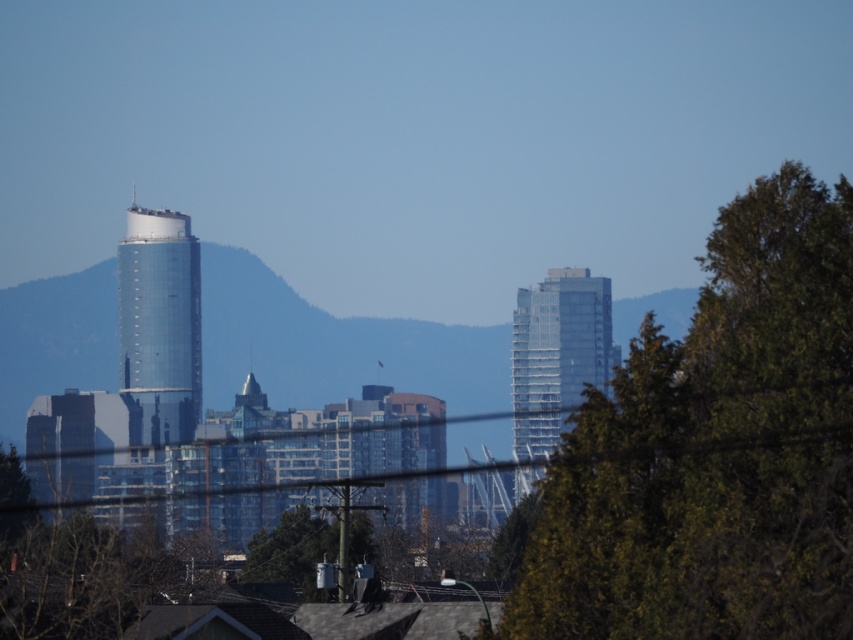
Question: Which object appears closest to the camera in this image?

Choices:
 (A) green matte tree at center
 (B) glossy glass tower at left

Answer: (A)

Question: Which of the following is the closest to the observer?

Choices:
 (A) green leafy tree at lower left
 (B) green matte tree at center

Answer: (B)

Question: Can you confirm if green leafy tree at right is positioned to the right of green leafy tree at lower left?

Choices:
 (A) no
 (B) yes

Answer: (B)

Question: Is glossy glass tower at left below green matte tree at center?

Choices:
 (A) yes
 (B) no

Answer: (B)

Question: Is green leafy tree at right positioned at the back of glossy glass tower at left?

Choices:
 (A) no
 (B) yes

Answer: (A)

Question: Based on their relative distances, which object is nearer to the green leafy tree at right?

Choices:
 (A) green matte tree at center
 (B) glossy glass tower at left

Answer: (A)